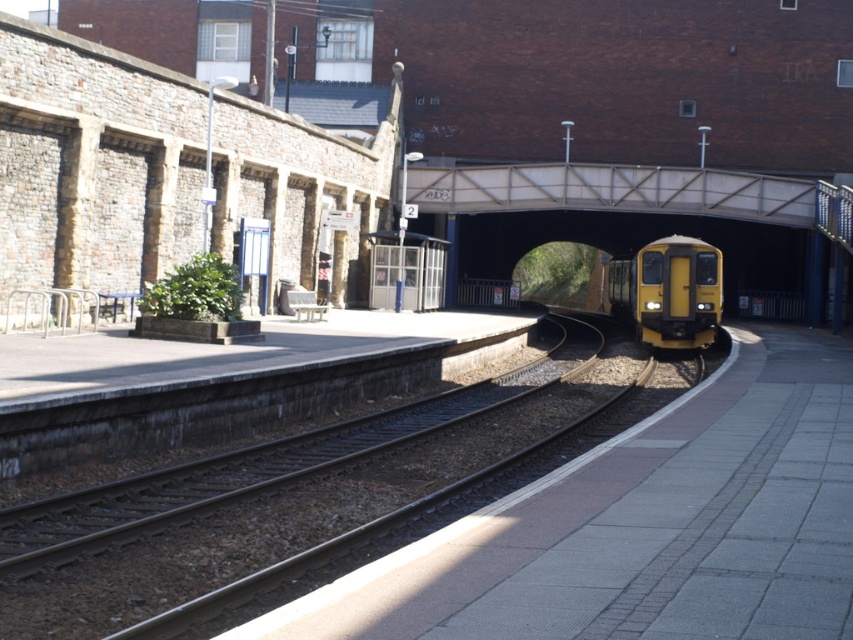
From the picture: Is smooth metal track at center below metallic gray bridge at upper center?

Yes.

How far apart are smooth metal track at center and metallic gray bridge at upper center?

smooth metal track at center is 14.13 meters away from metallic gray bridge at upper center.

Does point (222, 532) lie behind point (688, 184)?

No, it is in front of (688, 184).

Identify the location of smooth metal track at center. (277, 497).

Is metallic gray bridge at upper center positioned behind yellow matte train at center?

That is False.

Can you confirm if metallic gray bridge at upper center is positioned below yellow matte train at center?

No, metallic gray bridge at upper center is not below yellow matte train at center.

Which is in front, point (843, 195) or point (698, 333)?

Point (698, 333) is more forward.

Where is `metallic gray bridge at upper center`? This screenshot has width=853, height=640. metallic gray bridge at upper center is located at coordinates pyautogui.click(x=631, y=193).

Does smooth metal track at center appear on the right side of yellow matte train at center?

No, smooth metal track at center is not to the right of yellow matte train at center.

Which is in front, point (463, 433) or point (653, 260)?

Point (463, 433)

The width and height of the screenshot is (853, 640). Describe the element at coordinates (277, 497) in the screenshot. I see `smooth metal track at center` at that location.

You are a GUI agent. You are given a task and a screenshot of the screen. Output one action in this format:
    pyautogui.click(x=<x>, y=<y>)
    Task: Click on the smooth metal track at center
    
    Given the screenshot: What is the action you would take?
    pyautogui.click(x=277, y=497)